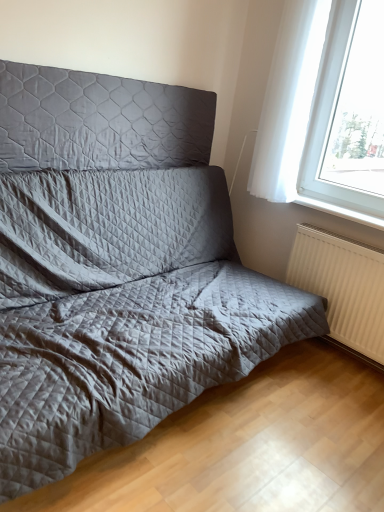
Where is `vacant region below white textured radiator at lower right (from a real-world perspective)`? Image resolution: width=384 pixels, height=512 pixels. vacant region below white textured radiator at lower right (from a real-world perspective) is located at coordinates (342, 354).